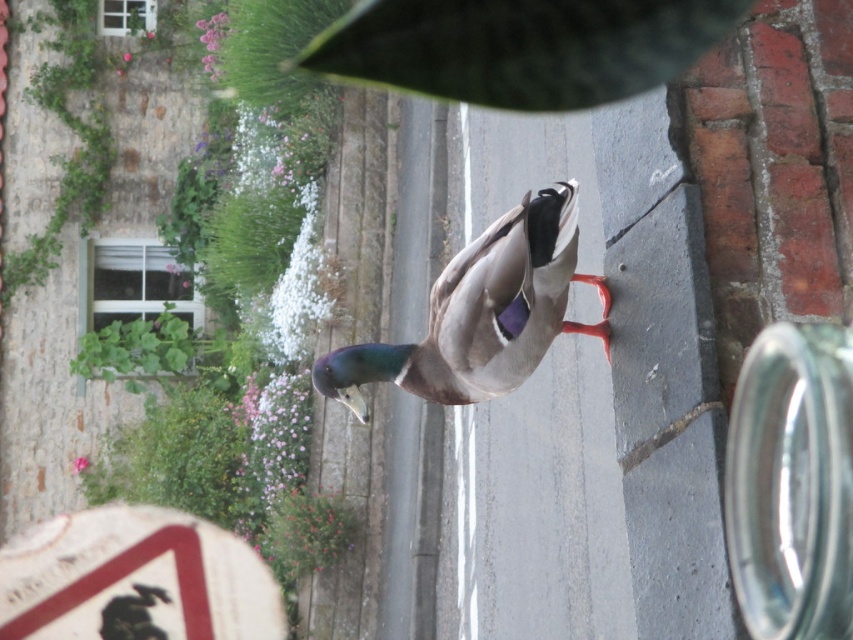
Can you confirm if shiny brown duck at center is smaller than green leafy plant at upper left?

Indeed, shiny brown duck at center has a smaller size compared to green leafy plant at upper left.

Is shiny brown duck at center to the right of green leafy plant at upper left from the viewer's perspective?

Yes, shiny brown duck at center is to the right of green leafy plant at upper left.

Which is behind, point (567, 228) or point (164, 349)?

The point (164, 349) is behind.

The width and height of the screenshot is (853, 640). In order to click on shiny brown duck at center in this screenshot , I will do `click(480, 314)`.